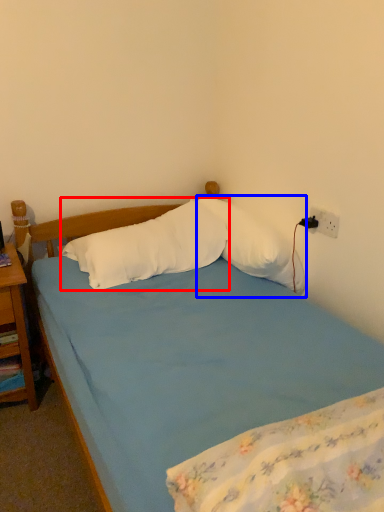
Question: Which point is closer to the camera, pillow (highlighted by a red box) or pillow (highlighted by a blue box)?

Choices:
 (A) pillow
 (B) pillow

Answer: (A)